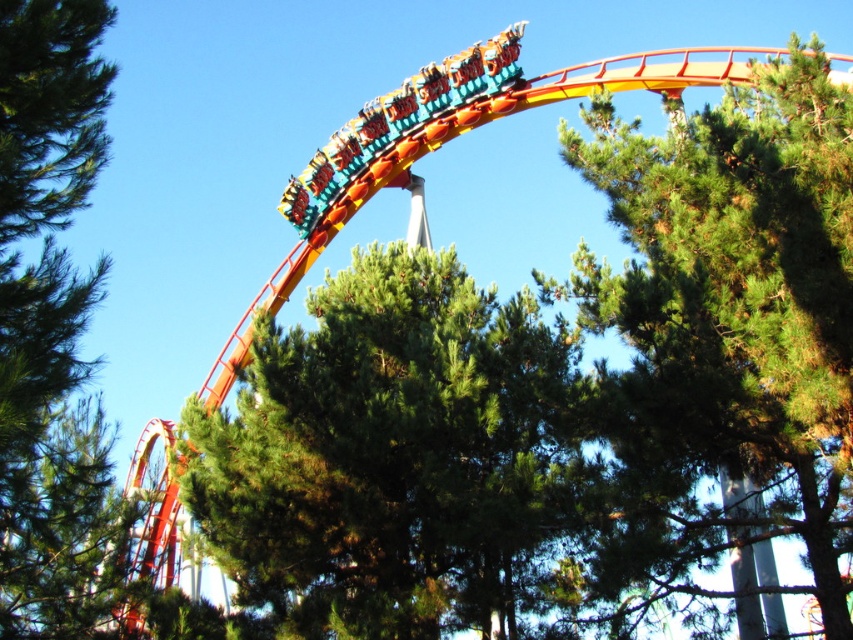
Question: Which point is closer to the camera?

Choices:
 (A) green textured tree at center
 (B) green leafy tree at upper left
 (C) green needle-like foliage at center

Answer: (B)

Question: Which point appears farthest from the camera in this image?

Choices:
 (A) (341, 378)
 (B) (51, 211)
 (C) (793, 342)

Answer: (A)

Question: Does green textured tree at center have a lesser width compared to green leafy tree at upper left?

Choices:
 (A) no
 (B) yes

Answer: (A)

Question: Observing the image, what is the correct spatial positioning of green needle-like foliage at center in reference to green leafy tree at upper left?

Choices:
 (A) above
 (B) below

Answer: (B)

Question: Considering the relative positions of green needle-like foliage at center and green leafy tree at upper left in the image provided, where is green needle-like foliage at center located with respect to green leafy tree at upper left?

Choices:
 (A) above
 (B) below

Answer: (B)

Question: Which of the following is the closest to the observer?

Choices:
 (A) green textured tree at center
 (B) green needle-like foliage at center

Answer: (A)